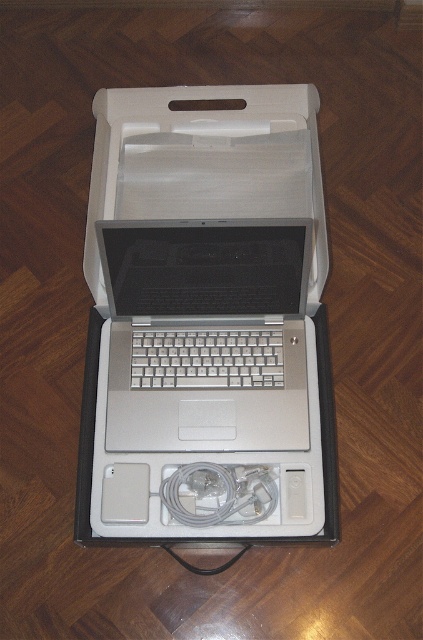
Between white plastic box at center and white matte charger at lower center, which one has more height?

With more height is white plastic box at center.

Can you confirm if white plastic box at center is bigger than white matte charger at lower center?

Indeed, white plastic box at center has a larger size compared to white matte charger at lower center.

Is point (255, 532) closer to viewer compared to point (176, 481)?

Yes, it is in front of point (176, 481).

Identify the location of white plastic box at center. The height and width of the screenshot is (640, 423). (206, 320).

Which is above, silver metallic laptop at center or white matte charger at lower center?

silver metallic laptop at center is higher up.

Can you confirm if silver metallic laptop at center is taller than white matte charger at lower center?

Yes, silver metallic laptop at center is taller than white matte charger at lower center.

At what (x,y) coordinates should I click in order to perform the action: click on silver metallic laptop at center. Please return your answer as a coordinate pair (x, y). The height and width of the screenshot is (640, 423). Looking at the image, I should click on (206, 333).

This screenshot has width=423, height=640. What are the coordinates of `silver metallic laptop at center` in the screenshot? It's located at (206, 333).

Find the location of `white plastic box at center`. white plastic box at center is located at coordinates (206, 320).

Between white plastic box at center and silver metallic laptop at center, which one is positioned lower?

Positioned lower is silver metallic laptop at center.

Who is more distant from viewer, [162,396] or [285,422]?

The point [162,396] is more distant.

I want to click on white plastic box at center, so click(x=206, y=320).